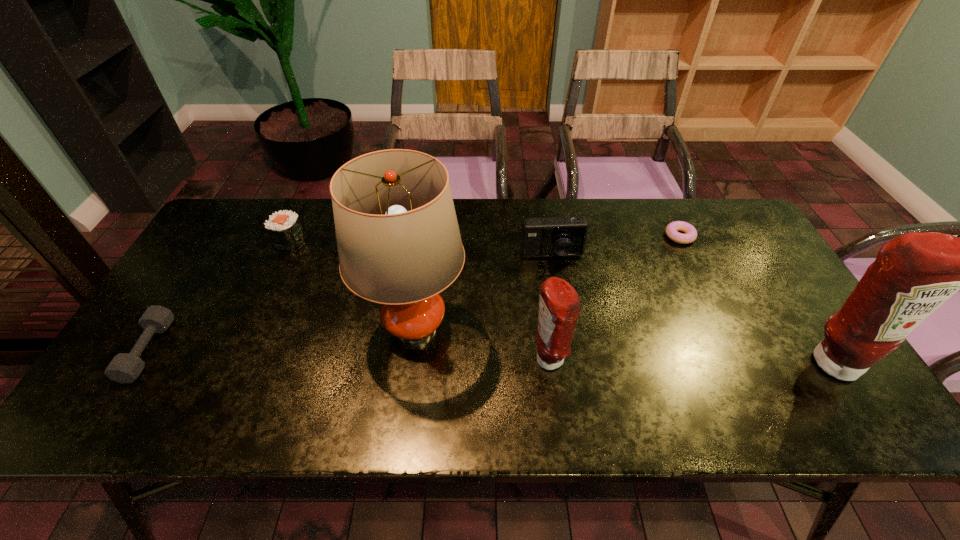
Where is `the third object from left to right`? The image size is (960, 540). the third object from left to right is located at coordinates (398, 240).

Locate an element on the screen. The image size is (960, 540). the leftmost object is located at coordinates (125, 367).

Identify the location of the second shortest object. (125, 367).

You are a GUI agent. You are given a task and a screenshot of the screen. Output one action in this format:
    pyautogui.click(x=<x>, y=<y>)
    Task: Click on the free space located 0.140m on the right of the shorter condiment
    This screenshot has width=960, height=540.
    Given the screenshot: What is the action you would take?
    click(x=624, y=360)

You are a GUI agent. You are given a task and a screenshot of the screen. Output one action in this format:
    pyautogui.click(x=<x>, y=<y>)
    Task: Click on the vacant space located on the left of the rightmost object
    Image resolution: width=960 pixels, height=540 pixels.
    Given the screenshot: What is the action you would take?
    pyautogui.click(x=755, y=362)

Where is `free space located on the front-facing side of the fourth shortest object`? This screenshot has height=540, width=960. free space located on the front-facing side of the fourth shortest object is located at coordinates (x=564, y=329).

Where is `vacant area situated on the front of the fifth tallest object`? The width and height of the screenshot is (960, 540). vacant area situated on the front of the fifth tallest object is located at coordinates (267, 290).

Identify the location of free space located on the left of the doughnut. The height and width of the screenshot is (540, 960). (564, 236).

You are a GUI agent. You are given a task and a screenshot of the screen. Output one action in this format:
    pyautogui.click(x=<x>, y=<y>)
    Task: Click on the vacant space positioned on the back of the third object from left to right
    
    Given the screenshot: What is the action you would take?
    pyautogui.click(x=429, y=219)

Image resolution: width=960 pixels, height=540 pixels. Identify the location of vacant position located on the back of the second shortest object. (180, 300).